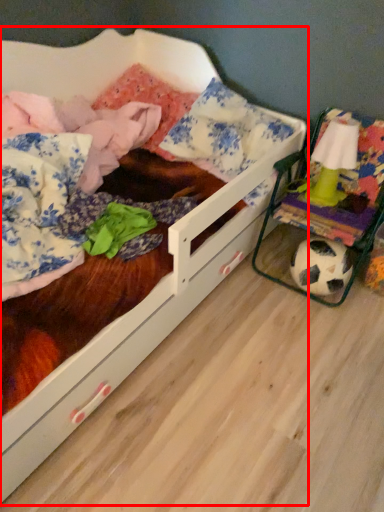
Question: Observing the image, what is the correct spatial positioning of infant bed (annotated by the red box) in reference to toy?

Choices:
 (A) left
 (B) right

Answer: (A)